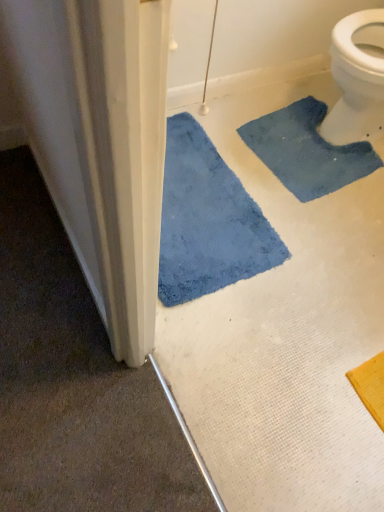
What do you see at coordinates (207, 220) in the screenshot? I see `blue plush bath mat at lower left, which is counted as the first bath mat, starting from the left` at bounding box center [207, 220].

Identify the location of blue plush bath mat at lower left, which ranks as the second bath mat in right-to-left order. The width and height of the screenshot is (384, 512). (207, 220).

In order to click on blue fuzzy bath mat at upper right, the first bath mat from the right in this screenshot , I will do `click(307, 150)`.

This screenshot has width=384, height=512. What do you see at coordinates (307, 150) in the screenshot?
I see `blue fuzzy bath mat at upper right, the second bath mat in the left-to-right sequence` at bounding box center [307, 150].

Where is `blue plush bath mat at lower left, which ranks as the second bath mat in right-to-left order`? The height and width of the screenshot is (512, 384). blue plush bath mat at lower left, which ranks as the second bath mat in right-to-left order is located at coordinates (207, 220).

Considering the positions of objects blue fuzzy bath mat at upper right, the first bath mat from the right, and blue plush bath mat at lower left, which is counted as the first bath mat, starting from the left, in the image provided, who is more to the left, blue fuzzy bath mat at upper right, the first bath mat from the right, or blue plush bath mat at lower left, which is counted as the first bath mat, starting from the left,?

blue plush bath mat at lower left, which is counted as the first bath mat, starting from the left.

Which object is further away from the camera, blue fuzzy bath mat at upper right, the first bath mat from the right, or blue plush bath mat at lower left, which is counted as the first bath mat, starting from the left?

blue fuzzy bath mat at upper right, the first bath mat from the right, is further from the camera.

Does point (348, 159) come behind point (232, 222)?

Yes, it is.

From the image's perspective, is blue fuzzy bath mat at upper right, the first bath mat from the right, above or below blue plush bath mat at lower left, which is counted as the first bath mat, starting from the left?

Clearly, from the image's perspective, blue fuzzy bath mat at upper right, the first bath mat from the right, is above blue plush bath mat at lower left, which is counted as the first bath mat, starting from the left.

From a real-world perspective, who is located higher, blue fuzzy bath mat at upper right, the first bath mat from the right, or blue plush bath mat at lower left, which is counted as the first bath mat, starting from the left?

From a 3D spatial view, blue plush bath mat at lower left, which is counted as the first bath mat, starting from the left, is above.

In the scene shown: Which of these two, blue fuzzy bath mat at upper right, the second bath mat in the left-to-right sequence, or blue plush bath mat at lower left, which is counted as the first bath mat, starting from the left, is wider?

blue plush bath mat at lower left, which is counted as the first bath mat, starting from the left, is wider.

Is blue fuzzy bath mat at upper right, the second bath mat in the left-to-right sequence, shorter than blue plush bath mat at lower left, which ranks as the second bath mat in right-to-left order?

Yes, blue fuzzy bath mat at upper right, the second bath mat in the left-to-right sequence, is shorter than blue plush bath mat at lower left, which ranks as the second bath mat in right-to-left order.

Can you confirm if blue fuzzy bath mat at upper right, the first bath mat from the right, is smaller than blue plush bath mat at lower left, which is counted as the first bath mat, starting from the left?

Correct, blue fuzzy bath mat at upper right, the first bath mat from the right, occupies less space than blue plush bath mat at lower left, which is counted as the first bath mat, starting from the left.

Is blue fuzzy bath mat at upper right, the first bath mat from the right, surrounding blue plush bath mat at lower left, which ranks as the second bath mat in right-to-left order?

That's incorrect, blue plush bath mat at lower left, which ranks as the second bath mat in right-to-left order, is not inside blue fuzzy bath mat at upper right, the first bath mat from the right.

Would you say blue fuzzy bath mat at upper right, the first bath mat from the right, is a long distance from blue plush bath mat at lower left, which is counted as the first bath mat, starting from the left?

No.

Is blue fuzzy bath mat at upper right, the second bath mat in the left-to-right sequence, facing towards blue plush bath mat at lower left, which ranks as the second bath mat in right-to-left order?

Yes.

Can you tell me how much blue fuzzy bath mat at upper right, the second bath mat in the left-to-right sequence, and blue plush bath mat at lower left, which is counted as the first bath mat, starting from the left, differ in facing direction?

The angular difference between blue fuzzy bath mat at upper right, the second bath mat in the left-to-right sequence, and blue plush bath mat at lower left, which is counted as the first bath mat, starting from the left, is 7.64 degrees.

At what (x,y) coordinates should I click in order to perform the action: click on bath mat above the blue plush bath mat at lower left, which is counted as the first bath mat, starting from the left (from the image's perspective). Please return your answer as a coordinate pair (x, y). This screenshot has width=384, height=512. Looking at the image, I should click on (307, 150).

Based on their positions, is blue plush bath mat at lower left, which is counted as the first bath mat, starting from the left, located to the left or right of blue fuzzy bath mat at upper right, the second bath mat in the left-to-right sequence?

blue plush bath mat at lower left, which is counted as the first bath mat, starting from the left, is to the left of blue fuzzy bath mat at upper right, the second bath mat in the left-to-right sequence.

In the image, is blue plush bath mat at lower left, which ranks as the second bath mat in right-to-left order, positioned in front of or behind blue fuzzy bath mat at upper right, the second bath mat in the left-to-right sequence?

In the image, blue plush bath mat at lower left, which ranks as the second bath mat in right-to-left order, appears in front of blue fuzzy bath mat at upper right, the second bath mat in the left-to-right sequence.

Considering the positions of points (177, 176) and (357, 159), is point (177, 176) closer to camera compared to point (357, 159)?

Yes, point (177, 176) is closer to viewer.

From the image's perspective, is blue plush bath mat at lower left, which is counted as the first bath mat, starting from the left, above or below blue fuzzy bath mat at upper right, the first bath mat from the right?

Clearly, from the image's perspective, blue plush bath mat at lower left, which is counted as the first bath mat, starting from the left, is below blue fuzzy bath mat at upper right, the first bath mat from the right.

From a real-world perspective, who is located lower, blue plush bath mat at lower left, which ranks as the second bath mat in right-to-left order, or blue fuzzy bath mat at upper right, the first bath mat from the right?

From a 3D spatial view, blue fuzzy bath mat at upper right, the first bath mat from the right, is below.

From the picture: Can you confirm if blue plush bath mat at lower left, which is counted as the first bath mat, starting from the left, is thinner than blue fuzzy bath mat at upper right, the first bath mat from the right?

No.

Can you confirm if blue plush bath mat at lower left, which is counted as the first bath mat, starting from the left, is taller than blue fuzzy bath mat at upper right, the first bath mat from the right?

Correct, blue plush bath mat at lower left, which is counted as the first bath mat, starting from the left, is much taller as blue fuzzy bath mat at upper right, the first bath mat from the right.

Considering the sizes of objects blue plush bath mat at lower left, which is counted as the first bath mat, starting from the left, and blue fuzzy bath mat at upper right, the first bath mat from the right, in the image provided, who is smaller, blue plush bath mat at lower left, which is counted as the first bath mat, starting from the left, or blue fuzzy bath mat at upper right, the first bath mat from the right,?

With smaller size is blue fuzzy bath mat at upper right, the first bath mat from the right.

From the picture: Is blue plush bath mat at lower left, which ranks as the second bath mat in right-to-left order, outside of blue fuzzy bath mat at upper right, the second bath mat in the left-to-right sequence?

blue plush bath mat at lower left, which ranks as the second bath mat in right-to-left order, lies outside blue fuzzy bath mat at upper right, the second bath mat in the left-to-right sequence,'s area.

Is there a large distance between blue plush bath mat at lower left, which ranks as the second bath mat in right-to-left order, and blue fuzzy bath mat at upper right, the first bath mat from the right?

Actually, blue plush bath mat at lower left, which ranks as the second bath mat in right-to-left order, and blue fuzzy bath mat at upper right, the first bath mat from the right, are a little close together.

Is blue plush bath mat at lower left, which ranks as the second bath mat in right-to-left order, aimed at blue fuzzy bath mat at upper right, the second bath mat in the left-to-right sequence?

No, blue plush bath mat at lower left, which ranks as the second bath mat in right-to-left order, is not aimed at blue fuzzy bath mat at upper right, the second bath mat in the left-to-right sequence.

What's the angular difference between blue plush bath mat at lower left, which is counted as the first bath mat, starting from the left, and blue fuzzy bath mat at upper right, the first bath mat from the right,'s facing directions?

The angle between the facing direction of blue plush bath mat at lower left, which is counted as the first bath mat, starting from the left, and the facing direction of blue fuzzy bath mat at upper right, the first bath mat from the right, is 7.64 degrees.

How much distance is there between blue plush bath mat at lower left, which ranks as the second bath mat in right-to-left order, and blue fuzzy bath mat at upper right, the second bath mat in the left-to-right sequence?

They are 14.15 inches apart.

The width and height of the screenshot is (384, 512). Identify the location of bath mat above the blue fuzzy bath mat at upper right, the second bath mat in the left-to-right sequence (from a real-world perspective). (207, 220).

Locate an element on the screen. bath mat in front of the blue fuzzy bath mat at upper right, the first bath mat from the right is located at coordinates pyautogui.click(x=207, y=220).

Where is `bath mat that is above the blue fuzzy bath mat at upper right, the first bath mat from the right (from a real-world perspective)`? The height and width of the screenshot is (512, 384). bath mat that is above the blue fuzzy bath mat at upper right, the first bath mat from the right (from a real-world perspective) is located at coordinates (207, 220).